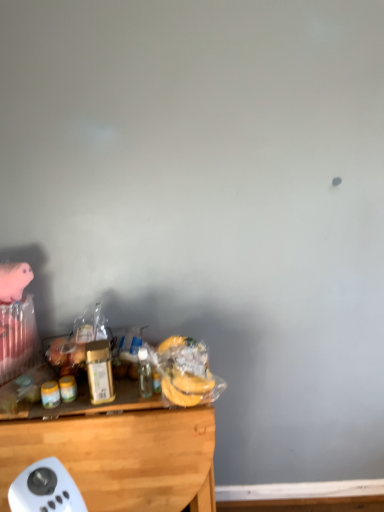
Locate an element on the screen. This screenshot has width=384, height=512. wooden desk at lower left is located at coordinates (119, 451).

Image resolution: width=384 pixels, height=512 pixels. What do you see at coordinates (144, 373) in the screenshot?
I see `translucent plastic bottle at center, marked as the first bottle in a right-to-left arrangement` at bounding box center [144, 373].

What is the approximate width of translucent plastic bottle at center, the 2th bottle in the left-to-right sequence?

2.53 inches.

Measure the distance between point (x=94, y=361) and camera.

The distance of point (x=94, y=361) from camera is 4.42 feet.

Locate an element on the screen. The width and height of the screenshot is (384, 512). yellow matte jar at left, the 1th food in the left-to-right sequence is located at coordinates (50, 394).

Where is `wooden desk at lower left`? The height and width of the screenshot is (512, 384). wooden desk at lower left is located at coordinates (119, 451).

Is point (156, 443) farther from viewer compared to point (110, 355)?

No, it is not.

From a real-world perspective, is wooden desk at lower left positioned under metallic gold canister at center, acting as the 2th bottle starting from the right, based on gravity?

Indeed, from a real-world perspective, wooden desk at lower left is positioned beneath metallic gold canister at center, acting as the 2th bottle starting from the right.

Who is smaller, wooden desk at lower left or metallic gold canister at center, acting as the 2th bottle starting from the right?

metallic gold canister at center, acting as the 2th bottle starting from the right, is smaller.

In the scene shown: Is wooden desk at lower left facing away from metallic gold canister at center, the first bottle positioned from the left?

No, metallic gold canister at center, the first bottle positioned from the left, is not at the back of wooden desk at lower left.

Which is behind, point (143, 361) or point (192, 385)?

The point (143, 361) is more distant.

Is translucent plastic bottle at center, marked as the first bottle in a right-to-left arrangement, outside of translucent plastic bananas at lower center, arranged as the second food when viewed from the left?

Yes, translucent plastic bottle at center, marked as the first bottle in a right-to-left arrangement, is outside of translucent plastic bananas at lower center, arranged as the second food when viewed from the left.

Is translucent plastic bottle at center, marked as the first bottle in a right-to-left arrangement, turned away from translucent plastic bananas at lower center, acting as the first food starting from the right?

That's not correct — translucent plastic bottle at center, marked as the first bottle in a right-to-left arrangement, is not looking away from translucent plastic bananas at lower center, acting as the first food starting from the right.

From a real-world perspective, who is located lower, translucent plastic bottle at center, marked as the first bottle in a right-to-left arrangement, or translucent plastic bananas at lower center, arranged as the second food when viewed from the left?

translucent plastic bananas at lower center, arranged as the second food when viewed from the left.

Is yellow matte jar at left, the 2th food viewed from the right, wider than translucent plastic bottle at center, marked as the first bottle in a right-to-left arrangement?

No, yellow matte jar at left, the 2th food viewed from the right, is not wider than translucent plastic bottle at center, marked as the first bottle in a right-to-left arrangement.

From the image's perspective, does yellow matte jar at left, the 2th food viewed from the right, appear lower than translucent plastic bottle at center, marked as the first bottle in a right-to-left arrangement?

Yes, from the image's perspective, yellow matte jar at left, the 2th food viewed from the right, is below translucent plastic bottle at center, marked as the first bottle in a right-to-left arrangement.

Which object is more forward, yellow matte jar at left, the 1th food in the left-to-right sequence, or translucent plastic bottle at center, the 2th bottle in the left-to-right sequence?

translucent plastic bottle at center, the 2th bottle in the left-to-right sequence.

Locate an element on the screen. desk on the left of translucent plastic bananas at lower center, acting as the first food starting from the right is located at coordinates (119, 451).

Which object is closer to the camera taking this photo, translucent plastic bananas at lower center, acting as the first food starting from the right, or wooden desk at lower left?

translucent plastic bananas at lower center, acting as the first food starting from the right, is more forward.

Looking at this image, is translucent plastic bananas at lower center, acting as the first food starting from the right, beside wooden desk at lower left?

translucent plastic bananas at lower center, acting as the first food starting from the right, is not next to wooden desk at lower left, and they're not touching.

Between point (191, 375) and point (200, 501), which one is positioned behind?

The point (200, 501) is farther.

Which is behind, translucent plastic bottle at center, the 2th bottle in the left-to-right sequence, or yellow matte jar at left, the 1th food in the left-to-right sequence?

yellow matte jar at left, the 1th food in the left-to-right sequence, is behind.

Is translucent plastic bottle at center, marked as the first bottle in a right-to-left arrangement, not close to yellow matte jar at left, the 2th food viewed from the right?

No, translucent plastic bottle at center, marked as the first bottle in a right-to-left arrangement, is in close proximity to yellow matte jar at left, the 2th food viewed from the right.

Which of these two, translucent plastic bottle at center, the 2th bottle in the left-to-right sequence, or yellow matte jar at left, the 1th food in the left-to-right sequence, is wider?

translucent plastic bottle at center, the 2th bottle in the left-to-right sequence, is wider.

From the image's perspective, is metallic gold canister at center, the first bottle positioned from the left, above translucent plastic bananas at lower center, acting as the first food starting from the right?

Correct, metallic gold canister at center, the first bottle positioned from the left, appears higher than translucent plastic bananas at lower center, acting as the first food starting from the right, in the image.

From a real-world perspective, is metallic gold canister at center, acting as the 2th bottle starting from the right, physically above translucent plastic bananas at lower center, arranged as the second food when viewed from the left?

Yes, from a real-world perspective, metallic gold canister at center, acting as the 2th bottle starting from the right, is above translucent plastic bananas at lower center, arranged as the second food when viewed from the left.

This screenshot has width=384, height=512. I want to click on bottle that is the 1st object located behind the translucent plastic bananas at lower center, arranged as the second food when viewed from the left, so click(99, 371).

Could you tell me if metallic gold canister at center, acting as the 2th bottle starting from the right, is facing translucent plastic bananas at lower center, arranged as the second food when viewed from the left?

No, metallic gold canister at center, acting as the 2th bottle starting from the right, is not oriented towards translucent plastic bananas at lower center, arranged as the second food when viewed from the left.

I want to click on the 1st bottle positioned above the translucent plastic bananas at lower center, acting as the first food starting from the right (from a real-world perspective), so click(x=144, y=373).

Considering the points (182, 405) and (142, 392), which point is in front, point (182, 405) or point (142, 392)?

The point (182, 405) is closer to the camera.

Which is in front, translucent plastic bananas at lower center, acting as the first food starting from the right, or translucent plastic bottle at center, marked as the first bottle in a right-to-left arrangement?

translucent plastic bananas at lower center, acting as the first food starting from the right, is in front.

From the image's perspective, between translucent plastic bananas at lower center, acting as the first food starting from the right, and translucent plastic bottle at center, marked as the first bottle in a right-to-left arrangement, which one is located above?

translucent plastic bottle at center, marked as the first bottle in a right-to-left arrangement.

Locate an element on the screen. desk to the left of metallic gold canister at center, the first bottle positioned from the left is located at coordinates (119, 451).

Find the location of a particular element. This screenshot has height=512, width=384. food that appears in front of the translucent plastic bottle at center, the 2th bottle in the left-to-right sequence is located at coordinates (185, 388).

Considering their positions, is translucent plastic bottle at center, the 2th bottle in the left-to-right sequence, positioned closer to metallic gold canister at center, acting as the 2th bottle starting from the right, than translucent plastic bananas at lower center, acting as the first food starting from the right?

translucent plastic bottle at center, the 2th bottle in the left-to-right sequence, is positioned closer to the anchor metallic gold canister at center, acting as the 2th bottle starting from the right.

Estimate the real-world distances between objects in this image. Which object is closer to metallic gold canister at center, the first bottle positioned from the left, translucent plastic bottle at center, marked as the first bottle in a right-to-left arrangement, or yellow matte jar at left, the 1th food in the left-to-right sequence?

translucent plastic bottle at center, marked as the first bottle in a right-to-left arrangement, is positioned closer to the anchor metallic gold canister at center, the first bottle positioned from the left.

Considering their positions, is yellow matte jar at left, the 2th food viewed from the right, positioned further to metallic gold canister at center, acting as the 2th bottle starting from the right, than translucent plastic bottle at center, the 2th bottle in the left-to-right sequence?

yellow matte jar at left, the 2th food viewed from the right, is positioned further to the anchor metallic gold canister at center, acting as the 2th bottle starting from the right.

From the image, which object appears to be farther from yellow matte jar at left, the 2th food viewed from the right, translucent plastic bananas at lower center, arranged as the second food when viewed from the left, or translucent plastic bottle at center, the 2th bottle in the left-to-right sequence?

Based on the image, translucent plastic bananas at lower center, arranged as the second food when viewed from the left, appears to be further to yellow matte jar at left, the 2th food viewed from the right.

From the image, which object appears to be nearer to metallic gold canister at center, the first bottle positioned from the left, translucent plastic bananas at lower center, arranged as the second food when viewed from the left, or wooden desk at lower left?

wooden desk at lower left is closer to metallic gold canister at center, the first bottle positioned from the left.

When comparing their distances from wooden desk at lower left, does translucent plastic bananas at lower center, arranged as the second food when viewed from the left, or metallic gold canister at center, the first bottle positioned from the left, seem further?

translucent plastic bananas at lower center, arranged as the second food when viewed from the left, is positioned further to the anchor wooden desk at lower left.

Considering their positions, is yellow matte jar at left, the 1th food in the left-to-right sequence, positioned further to translucent plastic bottle at center, the 2th bottle in the left-to-right sequence, than translucent plastic bananas at lower center, acting as the first food starting from the right?

Based on the image, yellow matte jar at left, the 1th food in the left-to-right sequence, appears to be further to translucent plastic bottle at center, the 2th bottle in the left-to-right sequence.

Estimate the real-world distances between objects in this image. Which object is further from translucent plastic bananas at lower center, acting as the first food starting from the right, wooden desk at lower left or metallic gold canister at center, the first bottle positioned from the left?

wooden desk at lower left is positioned further to the anchor translucent plastic bananas at lower center, acting as the first food starting from the right.

You are a GUI agent. You are given a task and a screenshot of the screen. Output one action in this format:
    pyautogui.click(x=<x>, y=<y>)
    Task: Click on the bottle between metallic gold canister at center, acting as the 2th bottle starting from the right, and translucent plastic bananas at lower center, arranged as the second food when viewed from the left
    The image size is (384, 512).
    Given the screenshot: What is the action you would take?
    pyautogui.click(x=144, y=373)

Image resolution: width=384 pixels, height=512 pixels. Identify the location of desk situated between yellow matte jar at left, the 2th food viewed from the right, and translucent plastic bananas at lower center, acting as the first food starting from the right, from left to right. (119, 451).

Where is `bottle between metallic gold canister at center, the first bottle positioned from the left, and wooden desk at lower left vertically`? This screenshot has width=384, height=512. bottle between metallic gold canister at center, the first bottle positioned from the left, and wooden desk at lower left vertically is located at coordinates (144, 373).

The height and width of the screenshot is (512, 384). I want to click on bottle between yellow matte jar at left, the 1th food in the left-to-right sequence, and translucent plastic bottle at center, the 2th bottle in the left-to-right sequence, from left to right, so click(x=99, y=371).